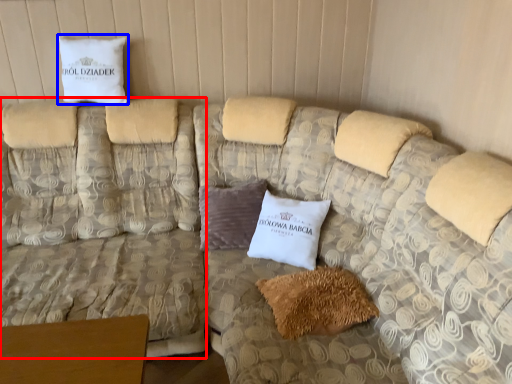
Question: Among these objects, which one is farthest to the camera, couch (highlighted by a red box) or pillow (highlighted by a blue box)?

Choices:
 (A) couch
 (B) pillow

Answer: (B)